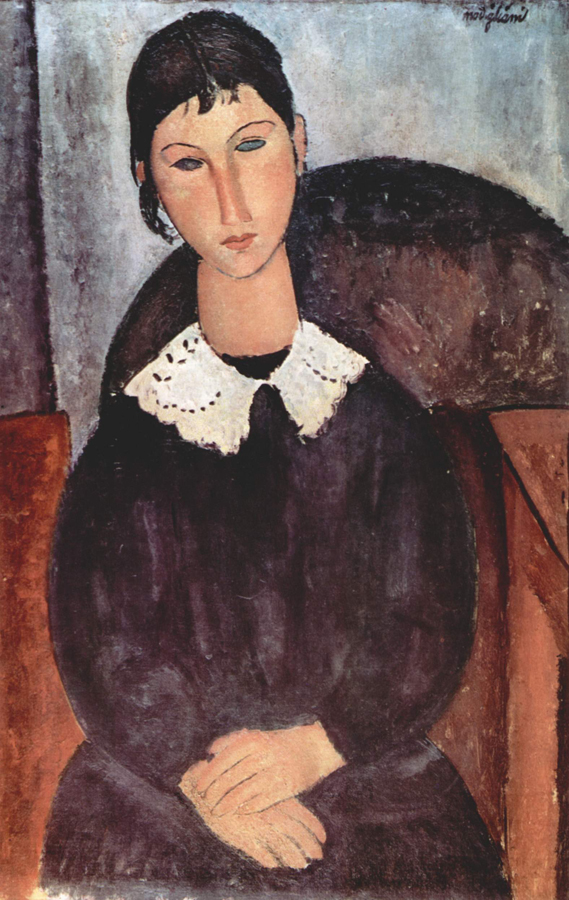
Locate an element on the screen. The height and width of the screenshot is (900, 569). chair is located at coordinates (370, 220).